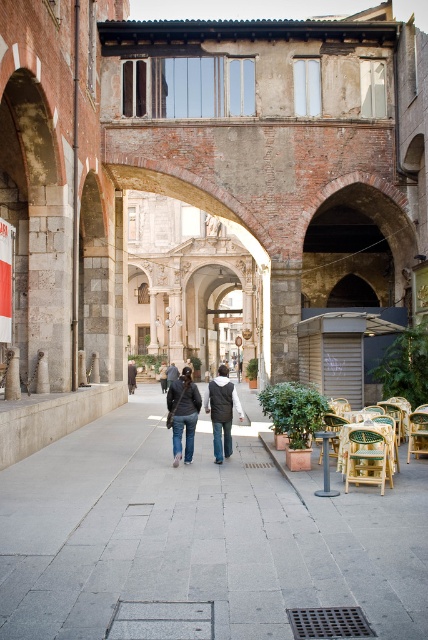
Between point (181, 384) and point (225, 397), which one is positioned in front?

Point (181, 384) is more forward.

At what (x,y) coordinates should I click in order to perform the action: click on denim jeans at center. Please return your answer as a coordinate pair (x, y). The height and width of the screenshot is (640, 428). Looking at the image, I should click on (183, 413).

Where is `denim jeans at center`? The width and height of the screenshot is (428, 640). denim jeans at center is located at coordinates (183, 413).

Does denim jacket at center have a larger size compared to dark gray fabric jacket at center?

Yes, denim jacket at center is bigger than dark gray fabric jacket at center.

Which is behind, point (220, 451) or point (220, 371)?

The point (220, 371) is more distant.

Does point (196, 404) lie in front of point (220, 368)?

Yes, it is in front of point (220, 368).

You are a GUI agent. You are given a task and a screenshot of the screen. Output one action in this format:
    pyautogui.click(x=<x>, y=<y>)
    Task: Click on the denim jacket at center
    
    Given the screenshot: What is the action you would take?
    pyautogui.click(x=183, y=413)

Is wooden chair at lower right above dark gray fabric jacket at center?

Correct, wooden chair at lower right is located above dark gray fabric jacket at center.

Between point (347, 483) and point (229, 420), which one is positioned behind?

The point (229, 420) is behind.

Identify the location of wooden chair at lower right. The height and width of the screenshot is (640, 428). (368, 460).